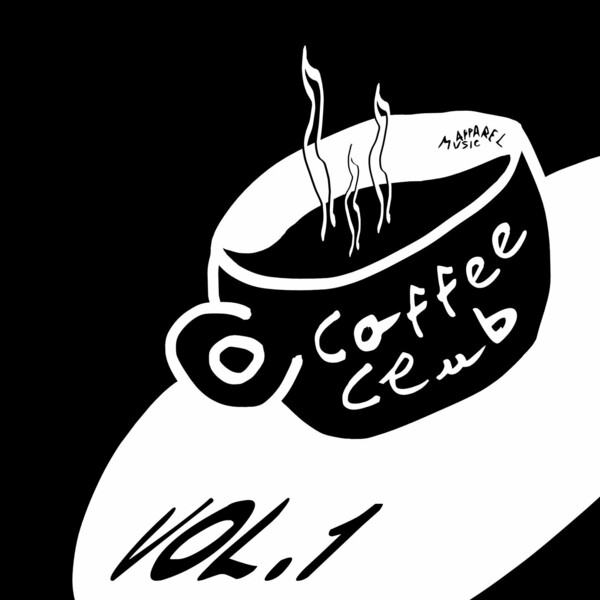
Locate an element on the screen. The image size is (600, 600). handle for coffee mug is located at coordinates (208, 375).